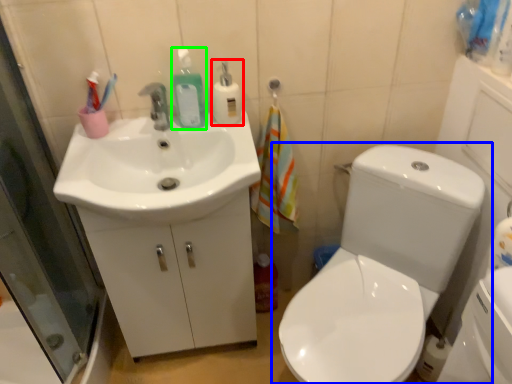
Question: Based on their relative distances, which object is nearer to cleaning product (highlighted by a red box)? Choose from toilet (highlighted by a blue box) and cleaning product (highlighted by a green box).

Choices:
 (A) toilet
 (B) cleaning product

Answer: (B)